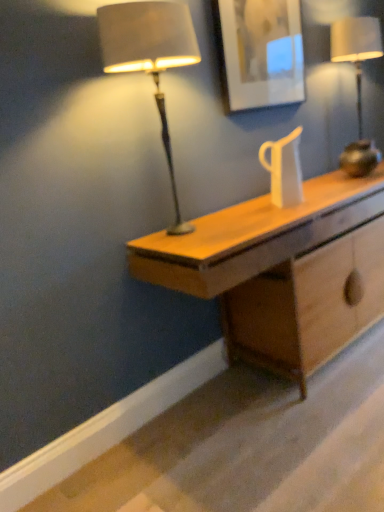
Question: Does matte brown lamp at left, the 1th lamp when ordered from front to back, contain matte white picture frame at upper center?

Choices:
 (A) no
 (B) yes

Answer: (A)

Question: Does matte brown lamp at left, the 2th lamp from the back, have a greater height compared to matte white picture frame at upper center?

Choices:
 (A) yes
 (B) no

Answer: (A)

Question: Is matte brown lamp at left, placed as the 2th lamp when sorted from right to left, thinner than matte white picture frame at upper center?

Choices:
 (A) no
 (B) yes

Answer: (A)

Question: Is matte brown lamp at left, the 2th lamp from the back, outside matte white picture frame at upper center?

Choices:
 (A) no
 (B) yes

Answer: (B)

Question: Can you confirm if matte brown lamp at left, placed as the 2th lamp when sorted from right to left, is positioned to the right of matte white picture frame at upper center?

Choices:
 (A) no
 (B) yes

Answer: (A)

Question: From a real-world perspective, does matte brown lamp at left, the 1th lamp when ordered from front to back, sit lower than matte white picture frame at upper center?

Choices:
 (A) yes
 (B) no

Answer: (A)

Question: Considering the relative positions of matte brown lamp at left, positioned as the 1th lamp in left-to-right order, and light wood desk at center in the image provided, is matte brown lamp at left, positioned as the 1th lamp in left-to-right order, in front of light wood desk at center?

Choices:
 (A) yes
 (B) no

Answer: (A)

Question: From the image's perspective, is matte brown lamp at left, the 2th lamp from the back, under light wood desk at center?

Choices:
 (A) yes
 (B) no

Answer: (B)

Question: Is matte brown lamp at left, positioned as the 1th lamp in left-to-right order, wider than light wood desk at center?

Choices:
 (A) no
 (B) yes

Answer: (A)

Question: From a real-world perspective, is matte brown lamp at left, placed as the 2th lamp when sorted from right to left, over light wood desk at center?

Choices:
 (A) yes
 (B) no

Answer: (A)

Question: From the image's perspective, is matte brown lamp at left, the 2th lamp from the back, over light wood desk at center?

Choices:
 (A) yes
 (B) no

Answer: (A)

Question: Is matte brown lamp at left, positioned as the 1th lamp in left-to-right order, further to camera compared to light wood desk at center?

Choices:
 (A) no
 (B) yes

Answer: (A)

Question: Considering the relative sizes of matte brown lamp at left, positioned as the 1th lamp in left-to-right order, and metallic gold lamp at right, acting as the 1th lamp starting from the back, in the image provided, is matte brown lamp at left, positioned as the 1th lamp in left-to-right order, wider than metallic gold lamp at right, acting as the 1th lamp starting from the back,?

Choices:
 (A) no
 (B) yes

Answer: (A)